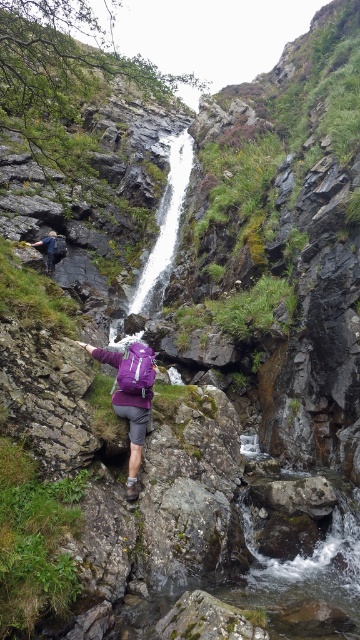
Question: Which object is closer to the camera taking this photo?

Choices:
 (A) purple fabric backpack at center
 (B) purple fabric backpack at lower left

Answer: (A)

Question: Is white smooth waterfall at center positioned behind purple fabric backpack at center?

Choices:
 (A) no
 (B) yes

Answer: (B)

Question: Does white smooth waterfall at center appear over purple fabric backpack at lower left?

Choices:
 (A) no
 (B) yes

Answer: (B)

Question: Which object appears farthest from the camera in this image?

Choices:
 (A) white smooth waterfall at center
 (B) purple fabric backpack at lower left
 (C) purple fabric backpack at center

Answer: (B)

Question: Can you confirm if white smooth waterfall at center is wider than purple fabric backpack at center?

Choices:
 (A) yes
 (B) no

Answer: (A)

Question: Which object appears closest to the camera in this image?

Choices:
 (A) white smooth waterfall at center
 (B) purple fabric backpack at center
 (C) purple fabric backpack at lower left

Answer: (B)